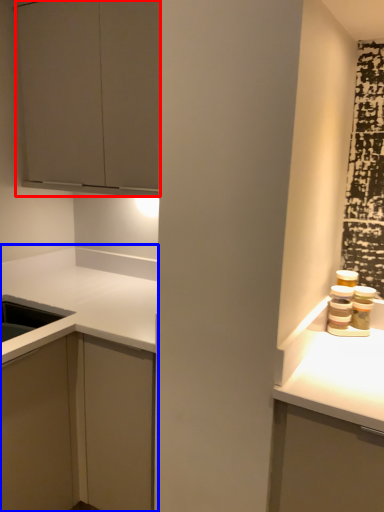
Question: Which object is closer to the camera taking this photo, cabinetry (highlighted by a red box) or cabinetry (highlighted by a blue box)?

Choices:
 (A) cabinetry
 (B) cabinetry

Answer: (B)